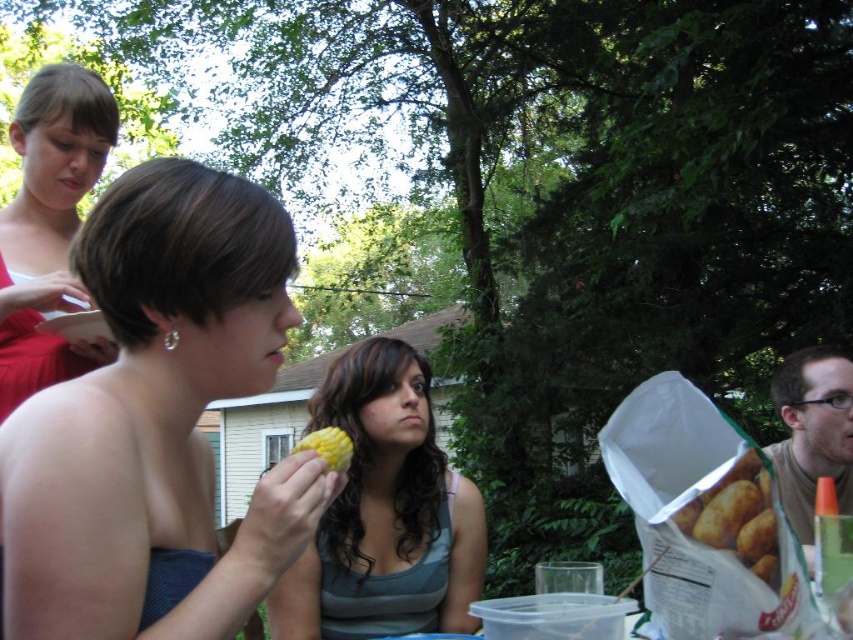
Question: Estimate the real-world distances between objects in this image. Which object is closer to the yellow matte corn at center?

Choices:
 (A) gray striped tank top at center
 (B) matte brown hair at right
 (C) matte red dress at upper left
 (D) matte yellow corn at center

Answer: (D)

Question: Is matte red dress at upper left to the right of matte brown hair at right from the viewer's perspective?

Choices:
 (A) no
 (B) yes

Answer: (A)

Question: Which of the following is the closest to the observer?

Choices:
 (A) (45, 365)
 (B) (850, 483)
 (C) (325, 433)
 (D) (718, 545)

Answer: (D)

Question: Does gray striped tank top at center appear on the left side of matte brown hair at right?

Choices:
 (A) yes
 (B) no

Answer: (A)

Question: Which object appears closest to the camera in this image?

Choices:
 (A) matte red dress at upper left
 (B) yellow matte corn at center
 (C) matte brown potato at lower right

Answer: (C)

Question: Is matte brown potato at lower right wider than yellow matte corn at center?

Choices:
 (A) no
 (B) yes

Answer: (A)